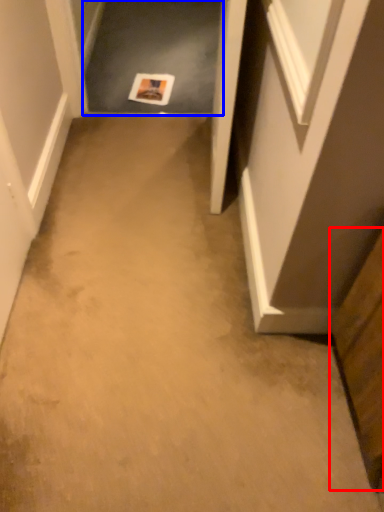
Question: Which object is closer to the camera taking this photo, cabinetry (highlighted by a red box) or passage (highlighted by a blue box)?

Choices:
 (A) cabinetry
 (B) passage

Answer: (A)